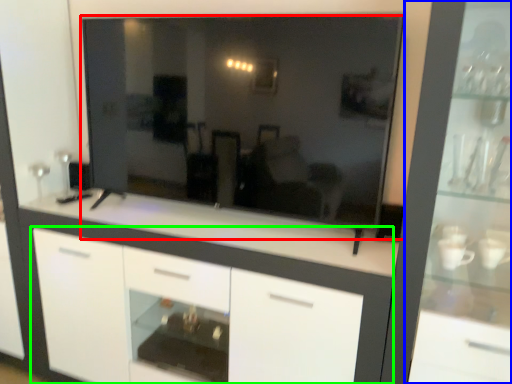
Question: Which object is positioned farthest from mirror (highlighted by a red box)? Select from dresser (highlighted by a blue box) and cabinetry (highlighted by a green box).

Choices:
 (A) dresser
 (B) cabinetry

Answer: (A)